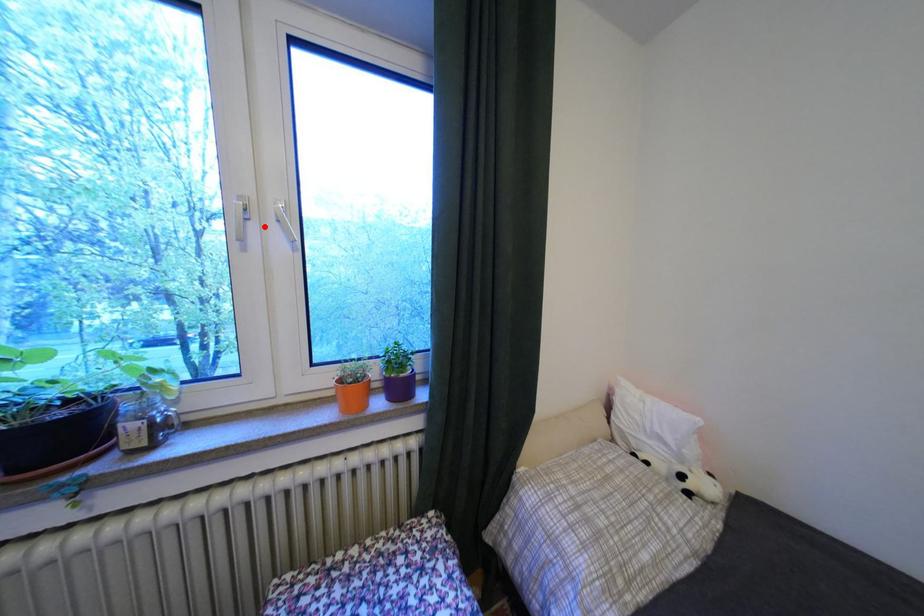
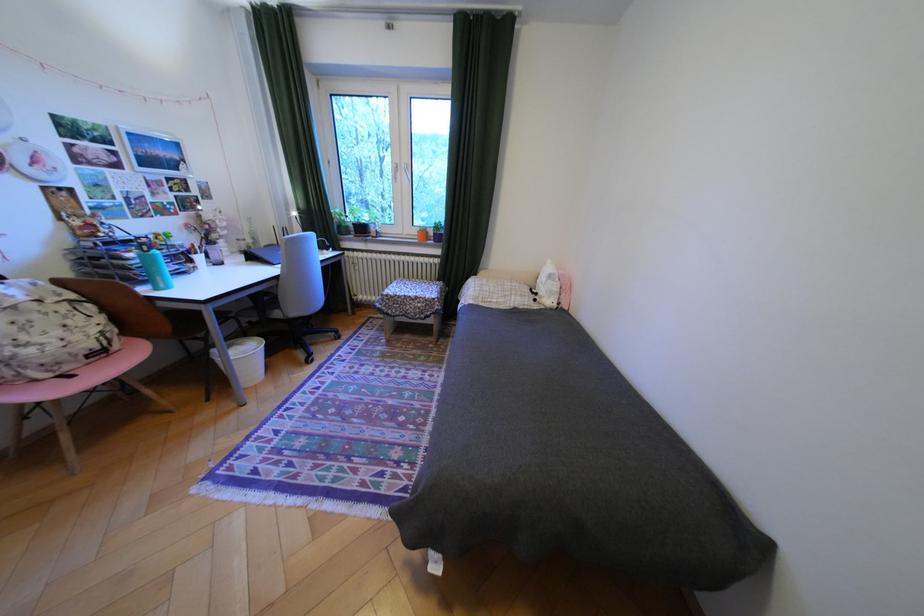
Question: I am providing you with two images of the same scene from different viewpoints. Given a red point in image1, look at the same physical point in image2. Is it:

Choices:
 (A) Closer to the viewpoint
 (B) Farther from the viewpoint

Answer: (A)